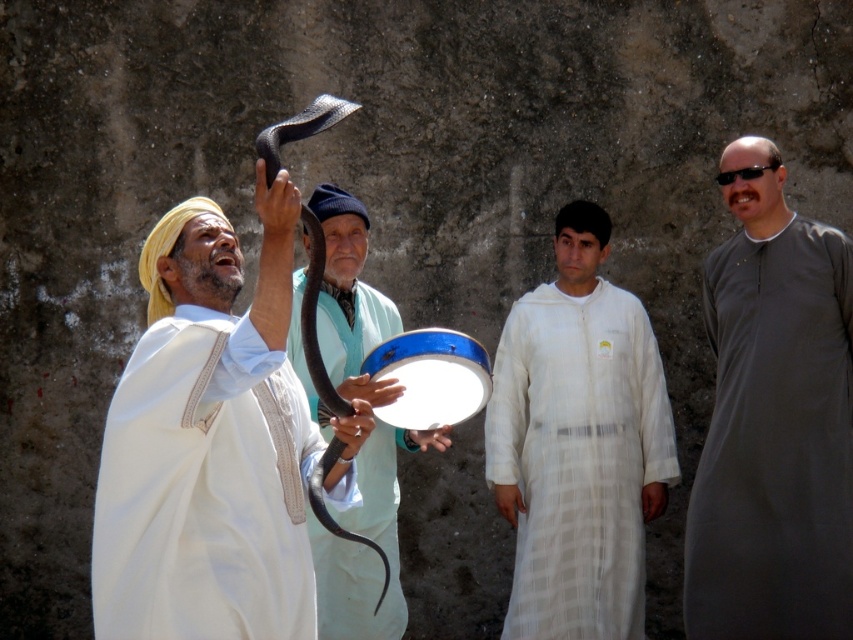
Does smooth white robe at left have a larger size compared to gray matte robe at center?

Yes.

Measure the distance between point [172,324] and camera.

14.75 meters

You are a GUI agent. You are given a task and a screenshot of the screen. Output one action in this format:
    pyautogui.click(x=<x>, y=<y>)
    Task: Click on the smooth white robe at left
    This screenshot has height=640, width=853.
    Given the screenshot: What is the action you would take?
    pyautogui.click(x=206, y=451)

Does smooth white robe at left have a larger size compared to black matte snake at upper center?

Indeed, smooth white robe at left has a larger size compared to black matte snake at upper center.

Can you confirm if smooth white robe at left is taller than black matte snake at upper center?

Correct, smooth white robe at left is much taller as black matte snake at upper center.

Find the location of `smooth white robe at left`. smooth white robe at left is located at coordinates (206, 451).

Which is behind, point (550, 508) or point (363, 612)?

Point (550, 508)

From the picture: Does white textured robe at center have a lesser width compared to light blue fabric at center?

No.

Between point (624, 502) and point (329, 556), which one is positioned in front?

Positioned in front is point (329, 556).

This screenshot has width=853, height=640. I want to click on white textured robe at center, so click(x=578, y=444).